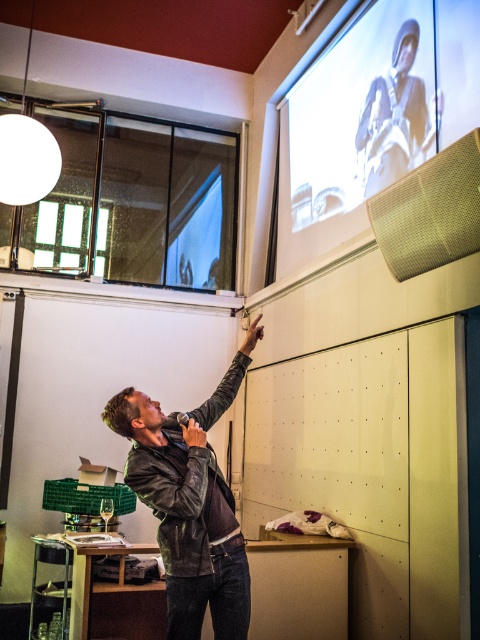
You are an attendee at the presentation. You need to quickly locate both the presenter and the screen. According to the scene, where is the white matte projection screen at upper right in relation to the leather jacket at center?

The white matte projection screen at upper right is to the right of the leather jacket at center.

You are organizing an event and need to ensure that the leather jacket at center does not block the view of the white matte projection screen at upper right. Based on their sizes, which object should you prioritize keeping in its current position?

The white matte projection screen at upper right is bigger than the leather jacket at center, so you should prioritize keeping the white matte projection screen at upper right in its current position to ensure it remains visible to the audience.

You are standing in the room where the presentation is happening. You want to move closer to the point at coordinates point (327, 92). If you can move 1 foot per second, how long will it take you to reach that point?

The point at coordinates point (327, 92) is 14.29 feet away from the camera, so it will take approximately 14.29 seconds to reach it at a speed of 1 foot per second.